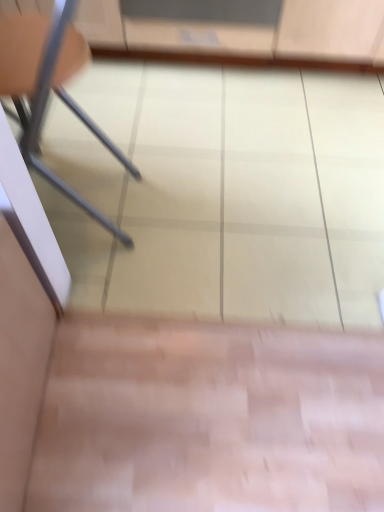
Question: Is transparent plastic screen door at upper center beside metallic gray chair at left?

Choices:
 (A) yes
 (B) no

Answer: (B)

Question: From the image's perspective, would you say transparent plastic screen door at upper center is shown under metallic gray chair at left?

Choices:
 (A) no
 (B) yes

Answer: (A)

Question: Does transparent plastic screen door at upper center lie behind metallic gray chair at left?

Choices:
 (A) no
 (B) yes

Answer: (B)

Question: Is transparent plastic screen door at upper center to the right of metallic gray chair at left from the viewer's perspective?

Choices:
 (A) no
 (B) yes

Answer: (B)

Question: Is transparent plastic screen door at upper center not inside metallic gray chair at left?

Choices:
 (A) no
 (B) yes

Answer: (B)

Question: From a real-world perspective, is transparent plastic screen door at upper center over metallic gray chair at left?

Choices:
 (A) yes
 (B) no

Answer: (B)

Question: Considering the relative sizes of metallic gray chair at left and transparent plastic screen door at upper center in the image provided, is metallic gray chair at left bigger than transparent plastic screen door at upper center?

Choices:
 (A) yes
 (B) no

Answer: (A)

Question: Are metallic gray chair at left and transparent plastic screen door at upper center far apart?

Choices:
 (A) yes
 (B) no

Answer: (B)

Question: From the image's perspective, is metallic gray chair at left located above transparent plastic screen door at upper center?

Choices:
 (A) yes
 (B) no

Answer: (B)

Question: From a real-world perspective, is metallic gray chair at left located beneath transparent plastic screen door at upper center?

Choices:
 (A) no
 (B) yes

Answer: (A)

Question: Are metallic gray chair at left and transparent plastic screen door at upper center beside each other?

Choices:
 (A) no
 (B) yes

Answer: (A)

Question: Can you confirm if metallic gray chair at left is wider than transparent plastic screen door at upper center?

Choices:
 (A) no
 (B) yes

Answer: (A)

Question: From the image's perspective, relative to transparent plastic screen door at upper center, is metallic gray chair at left above or below?

Choices:
 (A) above
 (B) below

Answer: (B)